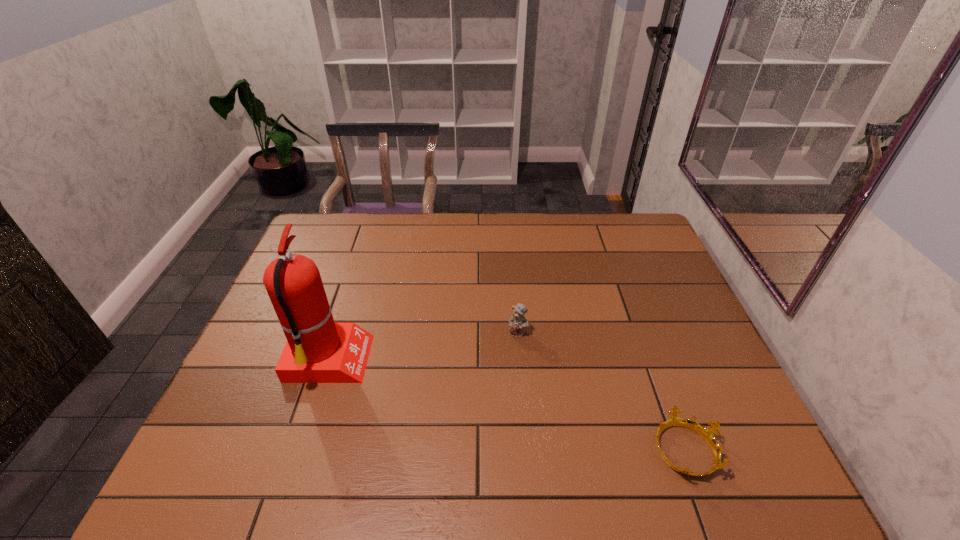
Image resolution: width=960 pixels, height=540 pixels. I want to click on fire extinguisher, so click(318, 350).

What are the coordinates of `the leftmost object` in the screenshot? It's located at (318, 350).

Where is `the second shortest object`? The height and width of the screenshot is (540, 960). the second shortest object is located at coordinates (517, 322).

The image size is (960, 540). What are the coordinates of `the second object from left to right` in the screenshot? It's located at (517, 322).

At what (x,y) coordinates should I click in order to perform the action: click on crown. Please return your answer as a coordinate pair (x, y). Image resolution: width=960 pixels, height=540 pixels. Looking at the image, I should click on (707, 433).

The width and height of the screenshot is (960, 540). Find the location of `the nearest object`. the nearest object is located at coordinates (707, 433).

This screenshot has height=540, width=960. I want to click on vacant area situated 0.140m on the front-facing side of the tallest object, so click(421, 362).

The image size is (960, 540). I want to click on free space located on the front-facing side of the second object from left to right, so click(526, 420).

Find the location of a particular element. free space located 0.390m on the back of the crown is located at coordinates (630, 302).

In order to click on object positioned at the near edge in this screenshot , I will do `click(707, 433)`.